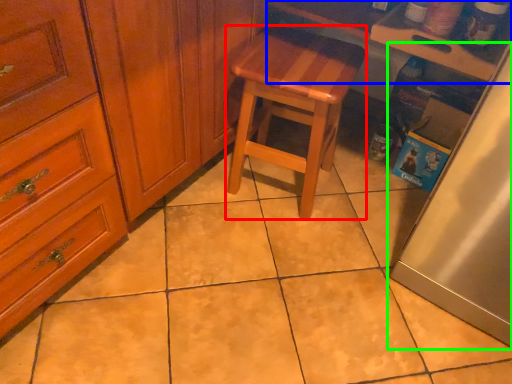
Question: Which is farther away from stool (highlighted by a red box)? counter top (highlighted by a blue box) or fridge (highlighted by a green box)?

Choices:
 (A) counter top
 (B) fridge

Answer: (B)